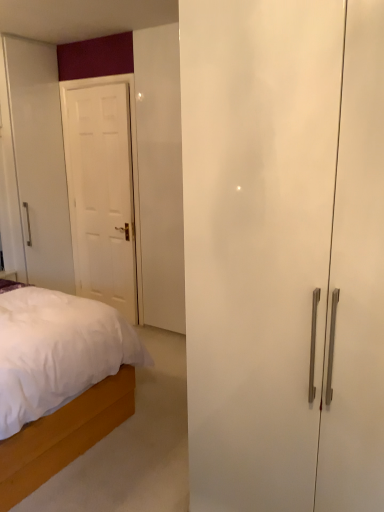
Question: Looking at their shapes, would you say white glossy door at left is wider or thinner than white wooden bed at lower left?

Choices:
 (A) wide
 (B) thin

Answer: (B)

Question: From the image's perspective, is white glossy door at left located above or below white wooden bed at lower left?

Choices:
 (A) above
 (B) below

Answer: (A)

Question: From a real-world perspective, is white glossy door at left physically located above or below white wooden bed at lower left?

Choices:
 (A) above
 (B) below

Answer: (A)

Question: Which is correct: white wooden bed at lower left is inside white glossy door at left, or outside of it?

Choices:
 (A) inside
 (B) outside

Answer: (B)

Question: In the image, is white wooden bed at lower left positioned in front of or behind white glossy door at left?

Choices:
 (A) front
 (B) behind

Answer: (A)

Question: From the image's perspective, is white wooden bed at lower left above or below white glossy door at left?

Choices:
 (A) below
 (B) above

Answer: (A)

Question: From a real-world perspective, is white wooden bed at lower left above or below white glossy door at left?

Choices:
 (A) below
 (B) above

Answer: (A)